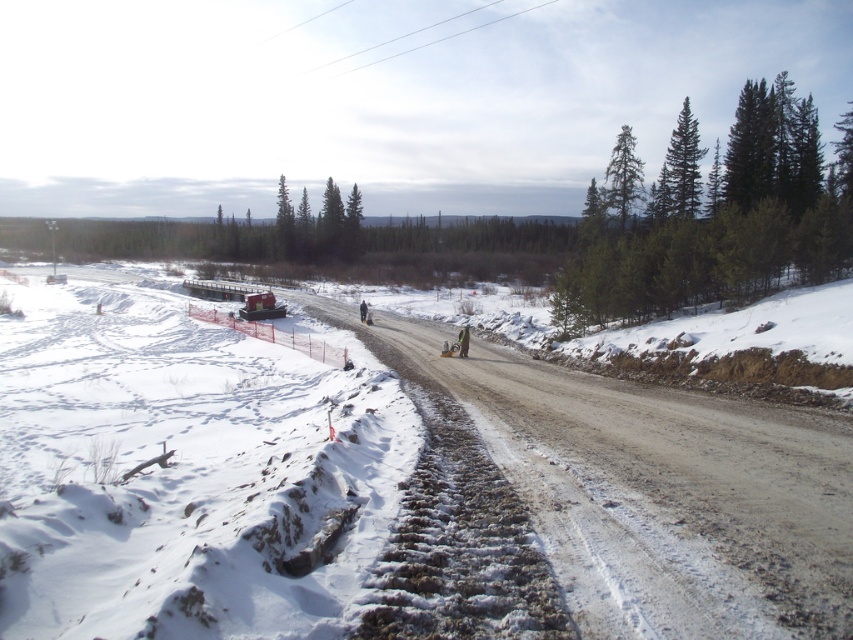
Question: Which of the following is the farthest from the observer?

Choices:
 (A) (465, 328)
 (B) (613, 531)

Answer: (A)

Question: Can you confirm if dusty gravel road at center is positioned to the right of dark brown leather jacket at center?

Choices:
 (A) yes
 (B) no

Answer: (A)

Question: Is dusty gravel road at center bigger than dark brown leather jacket at center?

Choices:
 (A) yes
 (B) no

Answer: (A)

Question: Can you confirm if dusty gravel road at center is positioned to the right of dark brown leather jacket at center?

Choices:
 (A) no
 (B) yes

Answer: (B)

Question: Which point is closer to the camera?

Choices:
 (A) (552, 464)
 (B) (459, 336)

Answer: (A)

Question: Which point is farther to the camera?

Choices:
 (A) (459, 353)
 (B) (521, 387)

Answer: (A)